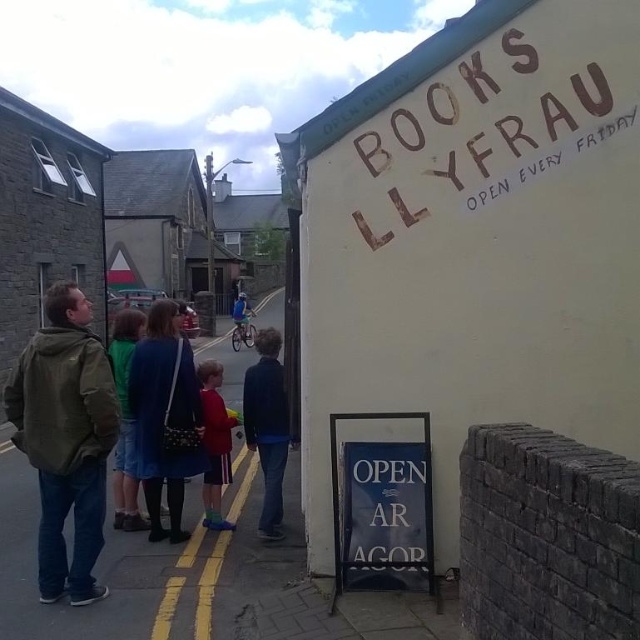
Question: Is red fabric bag at center closer to the viewer compared to yellow painted line at center?

Choices:
 (A) yes
 (B) no

Answer: (B)

Question: Among these objects, which one is nearest to the camera?

Choices:
 (A) red fabric jacket at center
 (B) blue denim jacket at center
 (C) olive-green jacket at left

Answer: (C)

Question: Does blue denim jeans at center appear on the left side of blue fabric jacket at center?

Choices:
 (A) no
 (B) yes

Answer: (A)

Question: Among these objects, which one is nearest to the camera?

Choices:
 (A) red fabric bag at center
 (B) blue denim jacket at center
 (C) blue fabric dress at center

Answer: (A)

Question: From the image, what is the correct spatial relationship of olive-green jacket at left in relation to blue denim jeans at center?

Choices:
 (A) above
 (B) below

Answer: (A)

Question: Among these objects, which one is farthest from the camera?

Choices:
 (A) red fabric bag at center
 (B) white painted sign at upper right
 (C) red fabric jacket at center

Answer: (C)